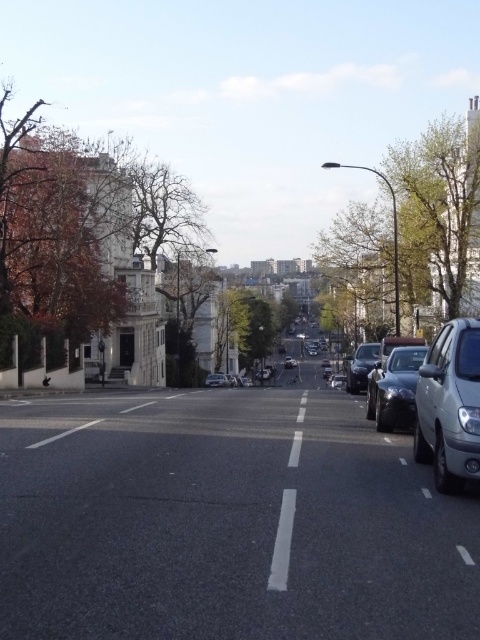
Question: Is green leafy tree at center smaller than satin black car at center?

Choices:
 (A) yes
 (B) no

Answer: (B)

Question: Considering the real-world distances, which object is closest to the green leafy tree at right?

Choices:
 (A) green leafy tree at center
 (B) satin black sedan at right
 (C) silver metallic sedan at center

Answer: (A)

Question: Estimate the real-world distances between objects in this image. Which object is closer to the satin black sedan at right?

Choices:
 (A) satin silver car at right
 (B) satin black car at center

Answer: (A)

Question: Is green leafy tree at right further to camera compared to silver metallic sedan at center?

Choices:
 (A) no
 (B) yes

Answer: (A)

Question: Which object is positioned closest to the silver metallic sedan at center?

Choices:
 (A) satin silver car at right
 (B) green leafy tree at center
 (C) satin black car at center
 (D) satin black sedan at right

Answer: (B)

Question: Does green leafy tree at center have a larger size compared to silver metallic sedan at center?

Choices:
 (A) yes
 (B) no

Answer: (A)